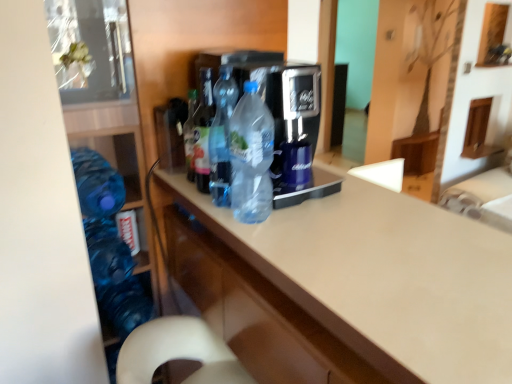
Identify the location of vacant region in front of translucent plastic bottle at center, which appears as the 4th bottle when viewed from the left. (283, 248).